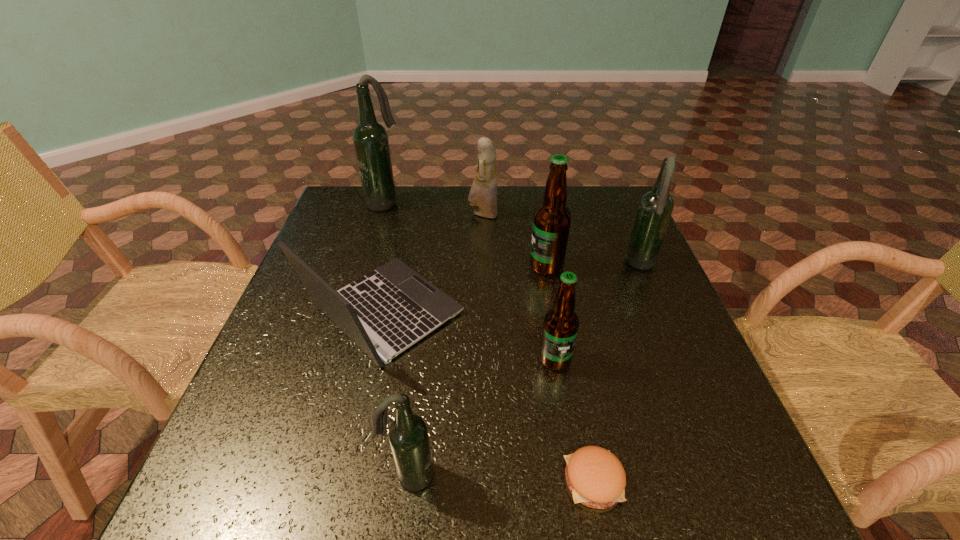
What are the coordinates of `the farthest dark beer bottle` in the screenshot? It's located at (370, 138).

Find the location of `the leftmost dark beer bottle`. the leftmost dark beer bottle is located at coordinates (370, 138).

The width and height of the screenshot is (960, 540). In order to click on the bigger brown beer bottle in this screenshot , I will do `click(551, 223)`.

Locate an element on the screen. The width and height of the screenshot is (960, 540). the rightmost dark beer bottle is located at coordinates (655, 208).

The height and width of the screenshot is (540, 960). Find the location of `the second smallest dark beer bottle`. the second smallest dark beer bottle is located at coordinates (655, 208).

The height and width of the screenshot is (540, 960). Identify the location of the fifth object from right to left. (483, 193).

You are a GUI agent. You are given a task and a screenshot of the screen. Output one action in this format:
    pyautogui.click(x=<x>, y=<y>)
    Task: Click on the fourth beer bottle from right to left
    
    Given the screenshot: What is the action you would take?
    pyautogui.click(x=408, y=436)

This screenshot has height=540, width=960. Find the location of `the nearest dark beer bottle`. the nearest dark beer bottle is located at coordinates (408, 436).

What are the coordinates of `the smaller brown beer bottle` in the screenshot? It's located at (561, 323).

Where is `the fourth farthest beer bottle`? the fourth farthest beer bottle is located at coordinates (561, 323).